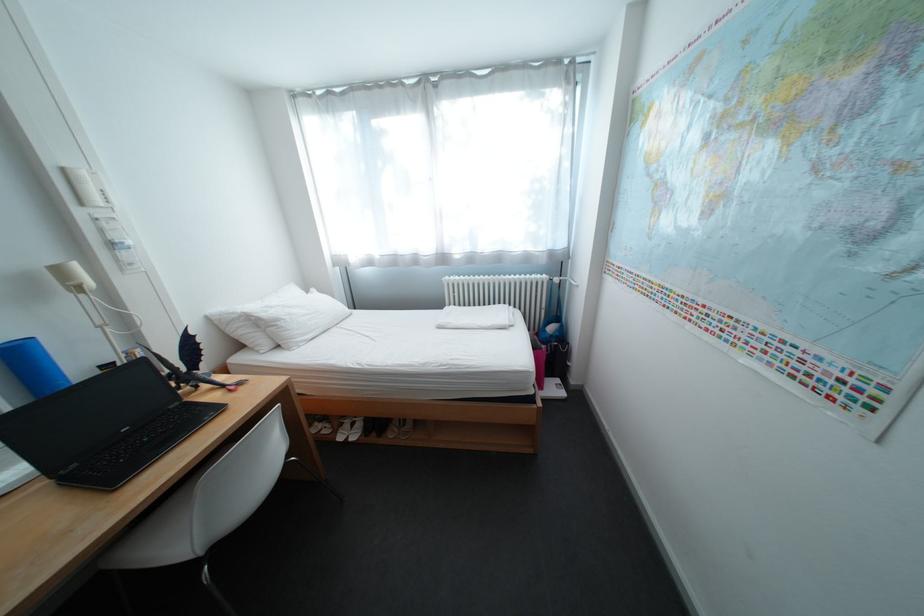
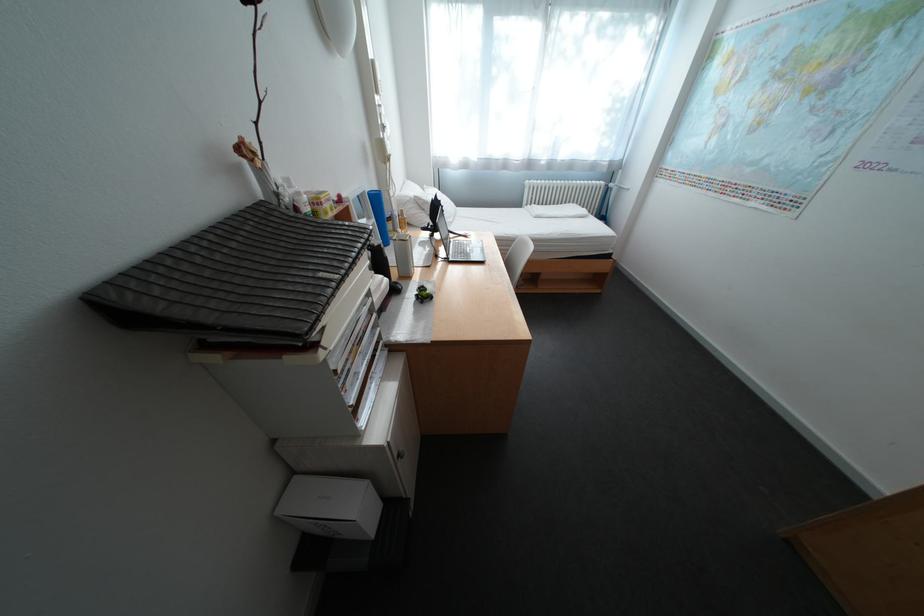
Find the pixel in the second image that matches point 236,387 in the first image.

(472, 236)